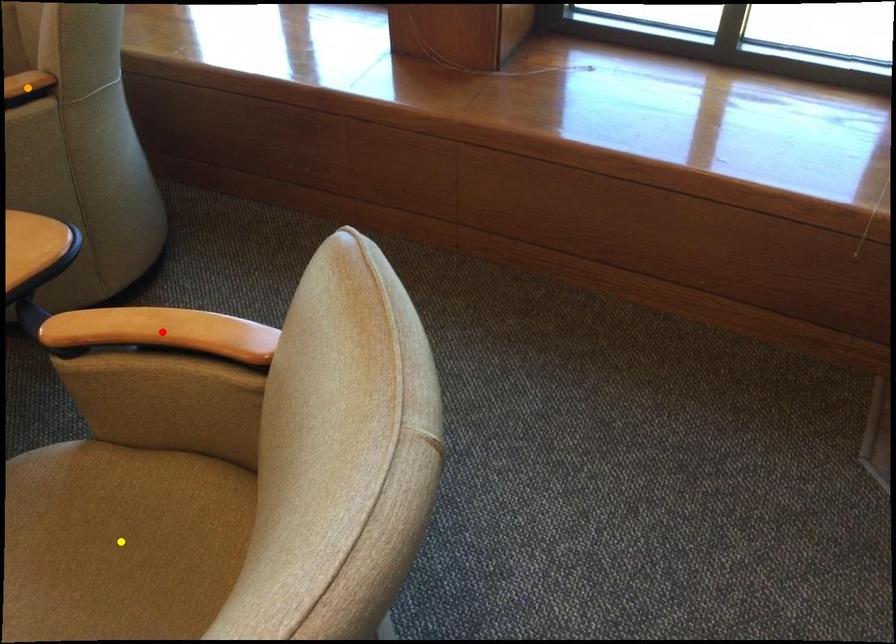
Order these from nearest to farthest:
A) orange point
B) red point
C) yellow point

1. orange point
2. red point
3. yellow point